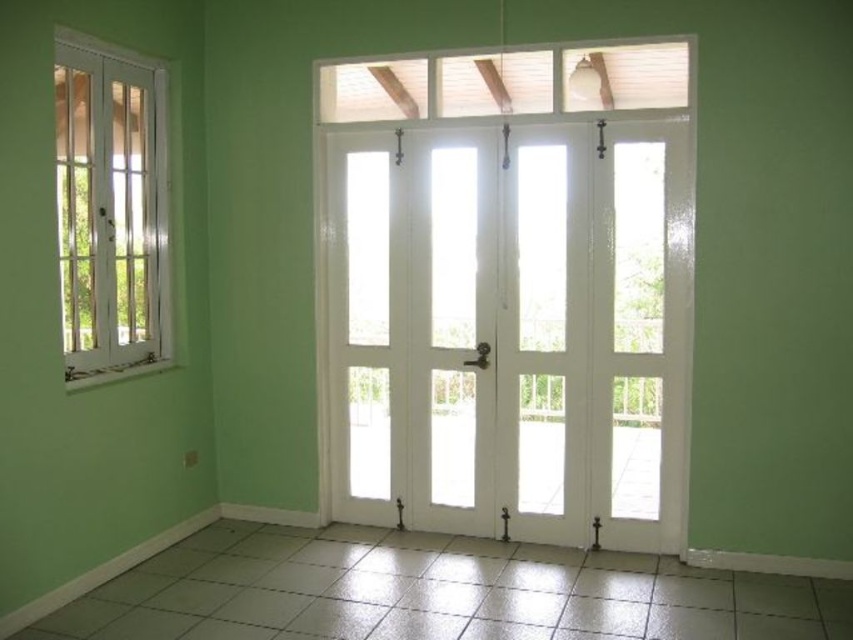
You are standing in the center of the room and want to exit through the white glass door at center. Which direction should you move to reach it?

Since the white glass door at center is located at point coordinates of (509, 332), you should move forward to reach it as it is directly in front of you.

You are standing in the room and want to exit through the nearest exit. The white glass door at center leads to the garden, while the white glass window at left is closed and cannot be opened. Which object should you use to exit?

The white glass door at center leads to the garden and is the nearest exit, so you should use the white glass door at center to exit.